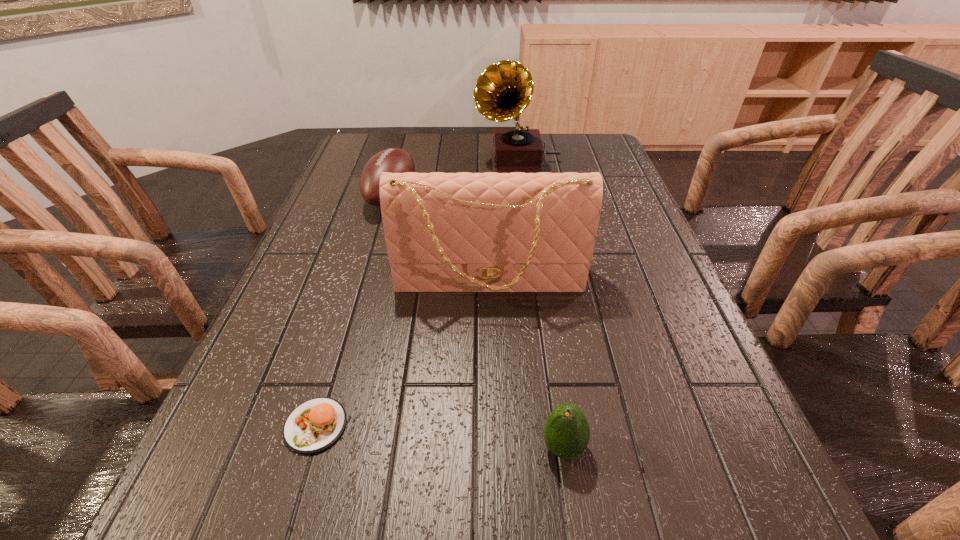
Identify the location of free space that satisfies the following two spatial constraints: 1. on the front-facing side of the avocado; 2. on the right side of the handbag. The height and width of the screenshot is (540, 960). (493, 447).

Where is `vacant region that satisfies the following two spatial constraints: 1. on the front side of the avocado; 2. on the right side of the patty`? vacant region that satisfies the following two spatial constraints: 1. on the front side of the avocado; 2. on the right side of the patty is located at coordinates (309, 447).

The width and height of the screenshot is (960, 540). What are the coordinates of `blank area in the image that satisfies the following two spatial constraints: 1. on the back side of the avocado; 2. from the horn of the phonograph record` in the screenshot? It's located at (521, 161).